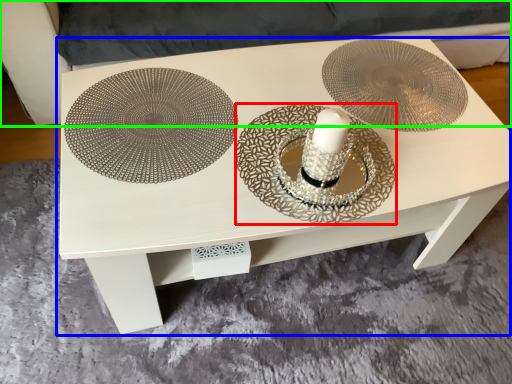
Question: Estimate the real-world distances between objects in this image. Which object is closer to plate (highlighted by a red box), table (highlighted by a blue box) or couch (highlighted by a green box)?

Choices:
 (A) table
 (B) couch

Answer: (A)